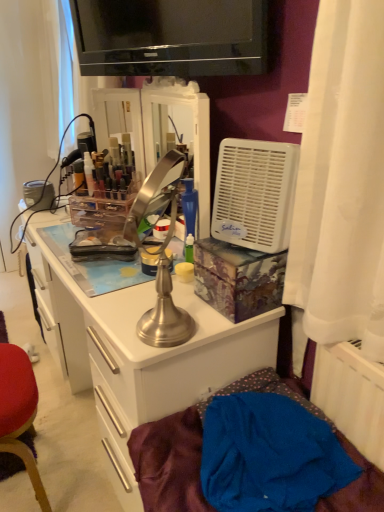
You are a GUI agent. You are given a task and a screenshot of the screen. Output one action in this format:
    pyautogui.click(x=<x>, y=<y>)
    Task: Click on the vacant area that is situated to the right of brushed metal table lamp at center
    Image resolution: width=384 pixels, height=512 pixels.
    Given the screenshot: What is the action you would take?
    pyautogui.click(x=211, y=325)